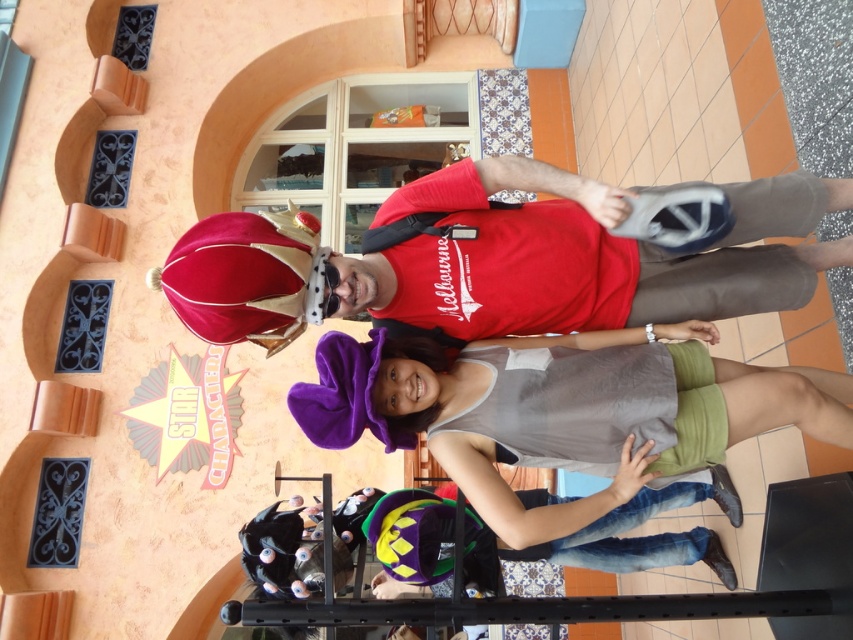
Question: Among these points, which one is farthest from the camera?

Choices:
 (A) (372, 310)
 (B) (392, 408)

Answer: (A)

Question: Considering the relative positions of velvet crown at upper center and gray fabric tank top at center in the image provided, where is velvet crown at upper center located with respect to gray fabric tank top at center?

Choices:
 (A) right
 (B) left

Answer: (B)

Question: Observing the image, what is the correct spatial positioning of velvet crown at upper center in reference to gray fabric tank top at center?

Choices:
 (A) below
 (B) above

Answer: (B)

Question: Which point is closer to the camera taking this photo?

Choices:
 (A) (346, 339)
 (B) (669, 300)

Answer: (A)

Question: Is velvet crown at upper center further to camera compared to gray fabric tank top at center?

Choices:
 (A) yes
 (B) no

Answer: (B)

Question: Among these points, which one is nearest to the camera?

Choices:
 (A) (747, 196)
 (B) (621, 435)

Answer: (B)